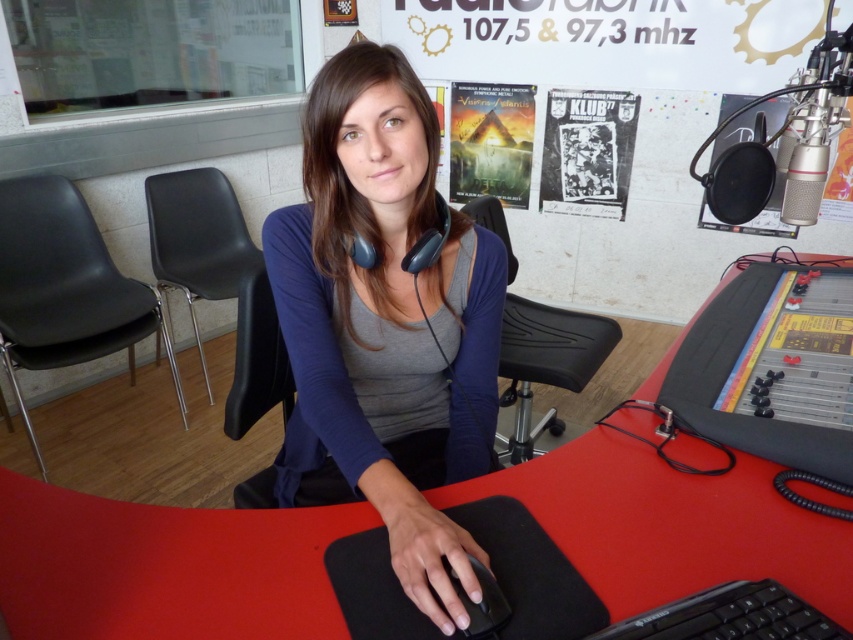
You are setting up a new microphone stand in the radio station studio. The stand needs to be placed between the matte black mouse at center and the matte paper poster at upper center. Is there enough vertical space between them to fit the stand?

The matte black mouse at center is positioned under the matte paper poster at upper center, so there is vertical space between them. However, the question mentions placing the microphone stand between them vertically. Since the mouse is under the poster, the vertical distance may be sufficient depending on the stand height. But without specific measurements, it is uncertain. However, according to the description, the mouse is directly under the poster, implying they are aligned vertically. Thus, there might

From the picture: You are setting up a new monitor stand that requires at least 10 cm of vertical space between the matte black mouse at center and the matte paper poster at upper center. Based on the scene description, will there be enough space?

The matte black mouse at center is taller than the matte paper poster at upper center, so there will not be enough vertical space between them for the monitor stand requiring 10 cm.

You are setting up a new microphone stand in the radio station studio. The stand needs to be placed between the black leather chair at center and the black plastic keyboard at lower right. Based on their positions, where should you position the microphone stand?

The microphone stand should be positioned between the black leather chair at center and the black plastic keyboard at lower right. Since the black leather chair at center is above the black plastic keyboard at lower right, the microphone stand should be placed below the black leather chair at center and above the black plastic keyboard at lower right to maintain the vertical alignment between them.